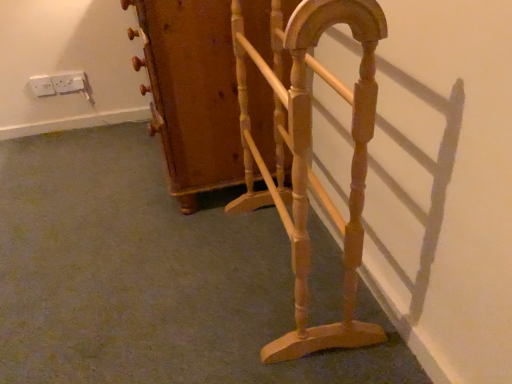
Question: From a real-world perspective, is white plastic socket at upper left, which is the 2th electric outlet in right-to-left order, above or below white plastic socket at upper left, which is the 2th electric outlet in left-to-right order?

Choices:
 (A) below
 (B) above

Answer: (B)

Question: From the image's perspective, is white plastic socket at upper left, which is counted as the first electric outlet, starting from the left, located above or below white plastic socket at upper left, the first electric outlet in the right-to-left sequence?

Choices:
 (A) above
 (B) below

Answer: (B)

Question: Which of these objects is positioned farthest from the white plastic socket at upper left, which is counted as the first electric outlet, starting from the left?

Choices:
 (A) wooden coat rack at center, the 2th furniture in the front-to-back sequence
 (B) light brown wood magazine rack at center, the first furniture when ordered from front to back
 (C) white plastic socket at upper left, the first electric outlet in the right-to-left sequence

Answer: (B)

Question: Which is farther from the wooden coat rack at center, the 2th furniture in the front-to-back sequence?

Choices:
 (A) white plastic socket at upper left, the first electric outlet in the right-to-left sequence
 (B) white plastic socket at upper left, which is the 2th electric outlet in right-to-left order
 (C) light brown wood magazine rack at center, the first furniture when ordered from front to back

Answer: (B)